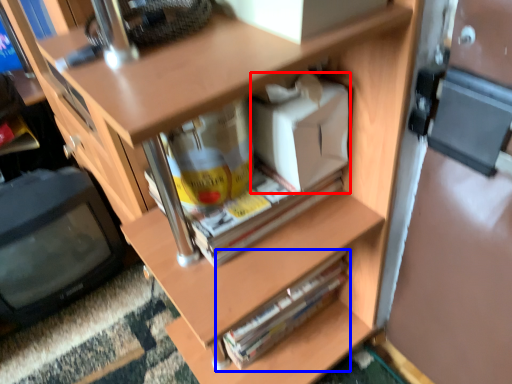
Question: Which object appears farthest to the camera in this image, box (highlighted by a red box) or paperback book (highlighted by a blue box)?

Choices:
 (A) box
 (B) paperback book

Answer: (B)